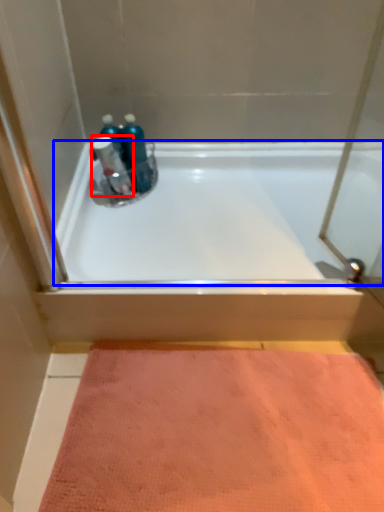
Question: Which point is further to the camera, cleaning product (highlighted by a red box) or bathtub (highlighted by a blue box)?

Choices:
 (A) cleaning product
 (B) bathtub

Answer: (A)